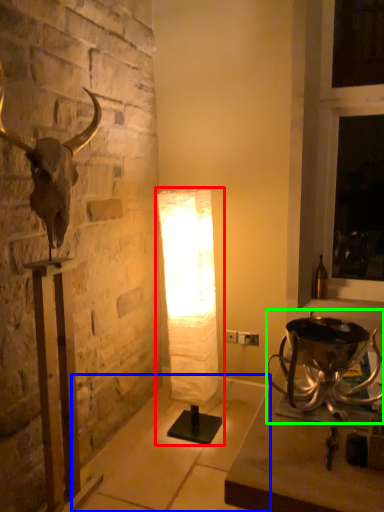
Question: Estimate the real-world distances between objects in this image. Which object is farther from lamp (highlighted by a red box), concrete (highlighted by a blue box) or candle holder (highlighted by a green box)?

Choices:
 (A) concrete
 (B) candle holder

Answer: (B)